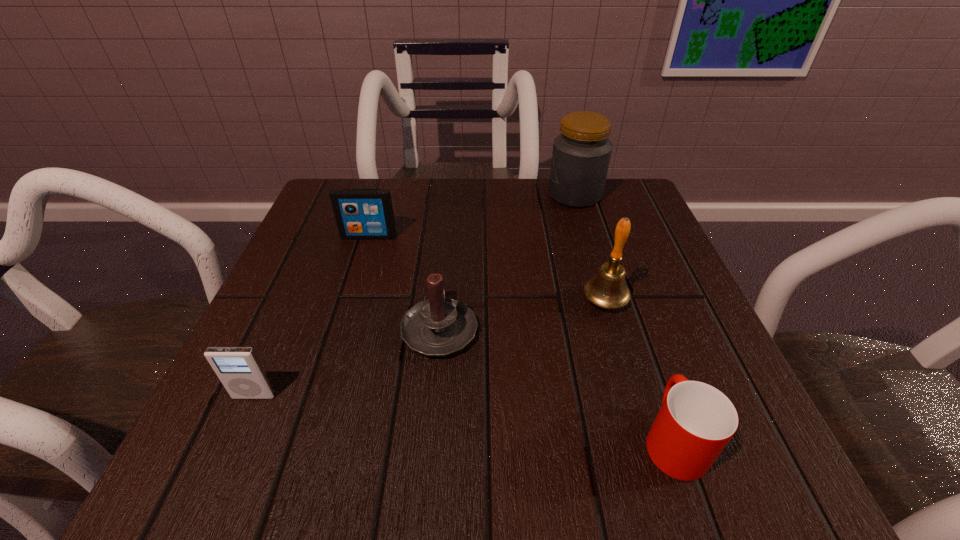
This screenshot has height=540, width=960. In order to click on jar present at the far edge in this screenshot , I will do `click(581, 155)`.

The height and width of the screenshot is (540, 960). I want to click on iPod that is at the far edge, so click(x=359, y=213).

Locate an element on the screen. object present at the near edge is located at coordinates (696, 421).

This screenshot has height=540, width=960. Find the location of `jar at the right edge`. jar at the right edge is located at coordinates (581, 155).

Image resolution: width=960 pixels, height=540 pixels. In order to click on bell that is positioned at the right edge in this screenshot , I will do `click(608, 290)`.

I want to click on cup located in the right edge section of the desktop, so click(696, 421).

This screenshot has height=540, width=960. What are the coordinates of `object that is at the far left corner` in the screenshot? It's located at (359, 213).

Image resolution: width=960 pixels, height=540 pixels. In order to click on object positioned at the far right corner in this screenshot , I will do `click(581, 155)`.

Locate an element on the screen. object that is positioned at the near right corner is located at coordinates click(x=696, y=421).

This screenshot has height=540, width=960. I want to click on free space at the far edge of the desktop, so click(469, 207).